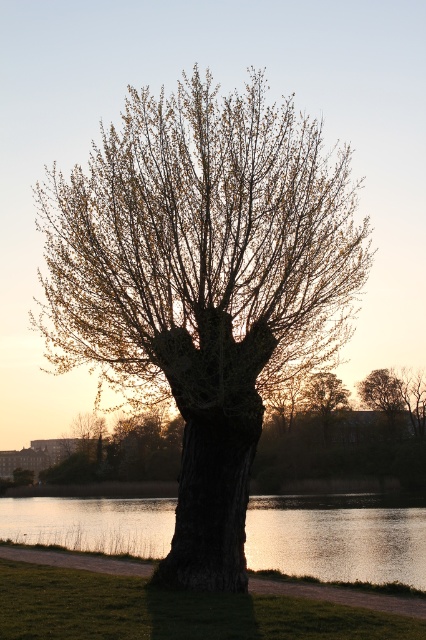
Question: Which point is farther to the camera?

Choices:
 (A) glistening water at tree right
 (B) smooth bark tree at center

Answer: (A)

Question: Which point appears farthest from the camera in this image?

Choices:
 (A) (408, 570)
 (B) (340, 316)

Answer: (A)

Question: From the image, what is the correct spatial relationship of smooth bark tree at center in relation to glistening water at tree right?

Choices:
 (A) above
 (B) below

Answer: (A)

Question: Where is smooth bark tree at center located in relation to glistening water at tree right in the image?

Choices:
 (A) left
 (B) right

Answer: (A)

Question: Does smooth bark tree at center appear on the left side of glistening water at tree right?

Choices:
 (A) no
 (B) yes

Answer: (B)